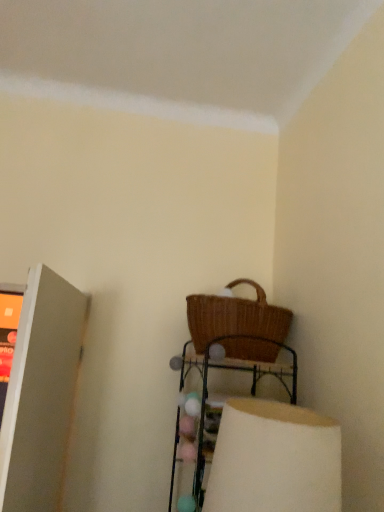
Question: Is matte gray shelf at left at the back of white matte lampshade at lower right?

Choices:
 (A) no
 (B) yes

Answer: (A)

Question: Is the surface of white matte lampshade at lower right in direct contact with matte gray shelf at left?

Choices:
 (A) yes
 (B) no

Answer: (B)

Question: Is white matte lampshade at lower right at the right side of matte gray shelf at left?

Choices:
 (A) no
 (B) yes

Answer: (B)

Question: Is white matte lampshade at lower right further to the viewer compared to matte gray shelf at left?

Choices:
 (A) no
 (B) yes

Answer: (A)

Question: Does white matte lampshade at lower right have a greater height compared to matte gray shelf at left?

Choices:
 (A) yes
 (B) no

Answer: (B)

Question: In terms of size, does woven wicker basket at upper center appear bigger or smaller than woven brown picnic basket at lower right?

Choices:
 (A) small
 (B) big

Answer: (B)

Question: From a real-world perspective, is woven wicker basket at upper center above or below woven brown picnic basket at lower right?

Choices:
 (A) below
 (B) above

Answer: (A)

Question: Looking at their shapes, would you say woven wicker basket at upper center is wider or thinner than woven brown picnic basket at lower right?

Choices:
 (A) wide
 (B) thin

Answer: (B)

Question: Would you say woven wicker basket at upper center is to the left or to the right of woven brown picnic basket at lower right in the picture?

Choices:
 (A) right
 (B) left

Answer: (B)

Question: In terms of height, does white matte lampshade at lower right look taller or shorter compared to woven brown picnic basket at lower right?

Choices:
 (A) short
 (B) tall

Answer: (B)

Question: Considering the positions of point (220, 478) and point (203, 303), is point (220, 478) closer or farther from the camera than point (203, 303)?

Choices:
 (A) farther
 (B) closer

Answer: (B)

Question: Looking at the image, does white matte lampshade at lower right seem bigger or smaller compared to woven brown picnic basket at lower right?

Choices:
 (A) big
 (B) small

Answer: (B)

Question: From a real-world perspective, is white matte lampshade at lower right positioned above or below woven brown picnic basket at lower right?

Choices:
 (A) above
 (B) below

Answer: (B)

Question: From a real-world perspective, relative to white matte lampshade at lower right, is matte gray shelf at left vertically above or below?

Choices:
 (A) below
 (B) above

Answer: (B)

Question: In terms of height, does matte gray shelf at left look taller or shorter compared to white matte lampshade at lower right?

Choices:
 (A) short
 (B) tall

Answer: (B)